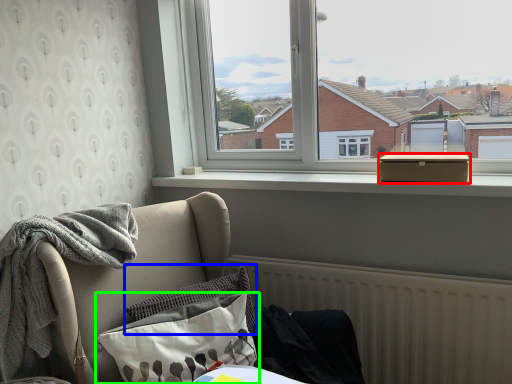
Question: Estimate the real-world distances between objects in this image. Which object is farther from box (highlighted by a red box), pillow (highlighted by a blue box) or pillow (highlighted by a green box)?

Choices:
 (A) pillow
 (B) pillow

Answer: (B)